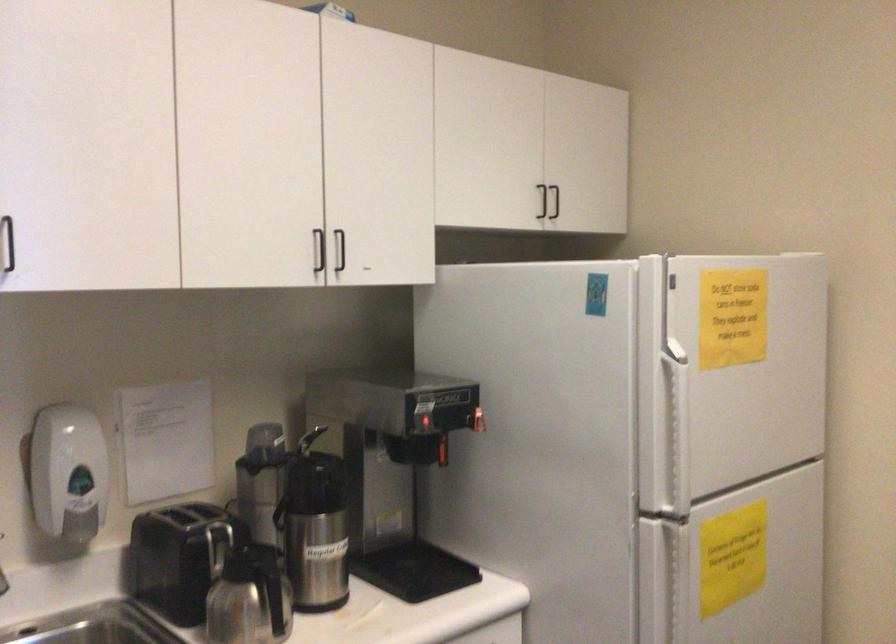
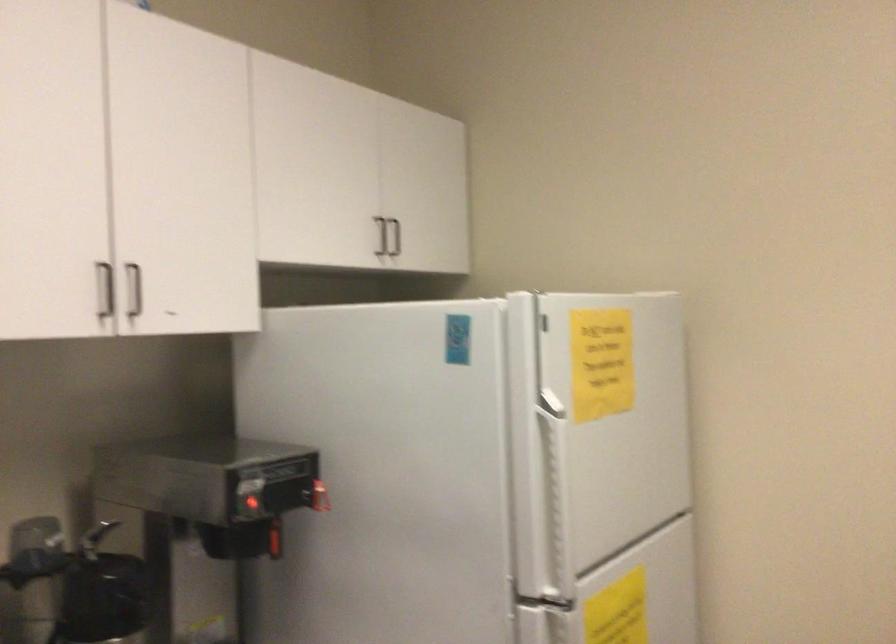
Question: The camera is either moving clockwise (left) or counter-clockwise (right) around the object. The first image is from the beginning of the video and the second image is from the end. Is the camera moving left or right when shooting the video?

Choices:
 (A) Left
 (B) Right

Answer: (A)